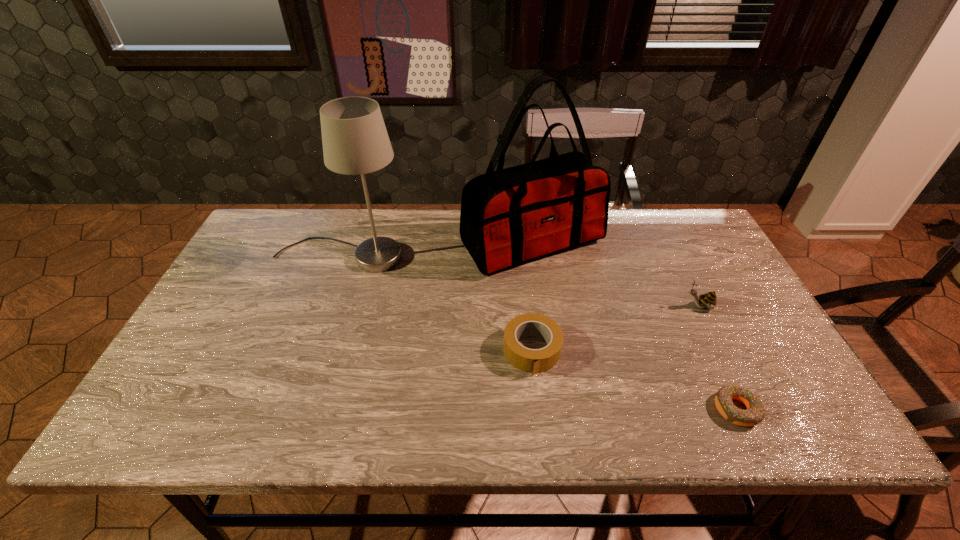
Where is `duffel bag`? duffel bag is located at coordinates (511, 216).

Identify the location of the leftmost object. This screenshot has width=960, height=540. (355, 141).

The height and width of the screenshot is (540, 960). I want to click on the third shortest object, so click(708, 300).

In order to click on the third farthest object in this screenshot , I will do `click(708, 300)`.

Image resolution: width=960 pixels, height=540 pixels. Identify the location of the second shortest object. (534, 361).

I want to click on the fourth farthest object, so click(534, 361).

At what (x,y) coordinates should I click in order to perform the action: click on the shortest object. Please return your answer as a coordinate pair (x, y). Looking at the image, I should click on (754, 414).

Identify the location of doughnut. The height and width of the screenshot is (540, 960). (754, 414).

Image resolution: width=960 pixels, height=540 pixels. What are the coordinates of `free space located on the right of the duffel bag` in the screenshot? It's located at (712, 242).

Image resolution: width=960 pixels, height=540 pixels. What are the coordinates of `vacant area located 0.280m on the front of the table lamp` in the screenshot? It's located at (305, 357).